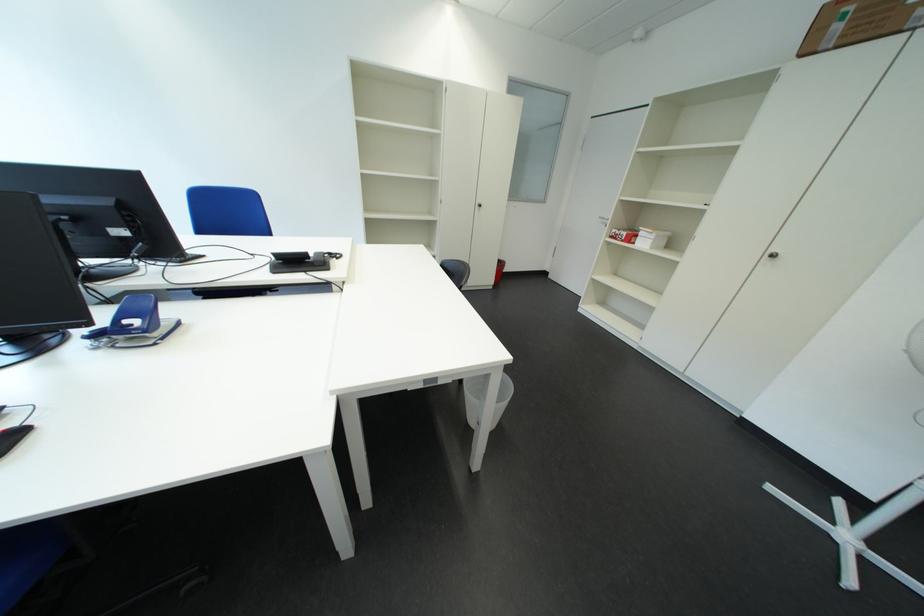
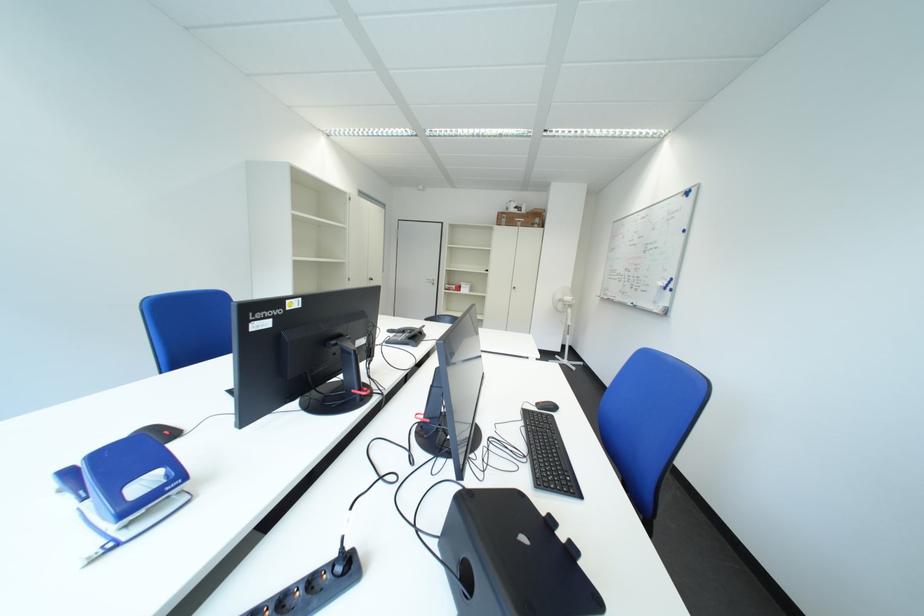
The point at [849,30] is marked in the first image. Where is the corresponding point in the second image?

(517, 223)